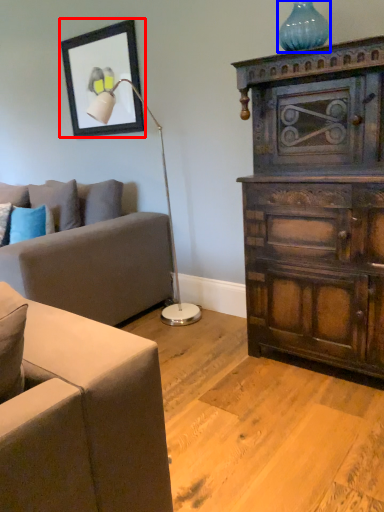
Question: Which object is further to the camera taking this photo, picture frame (highlighted by a red box) or vase (highlighted by a blue box)?

Choices:
 (A) picture frame
 (B) vase

Answer: (A)